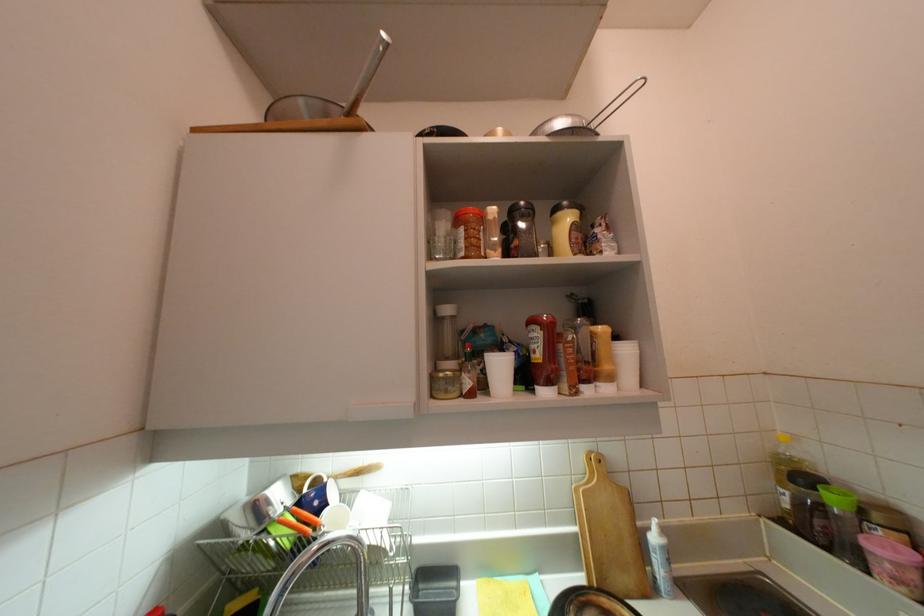
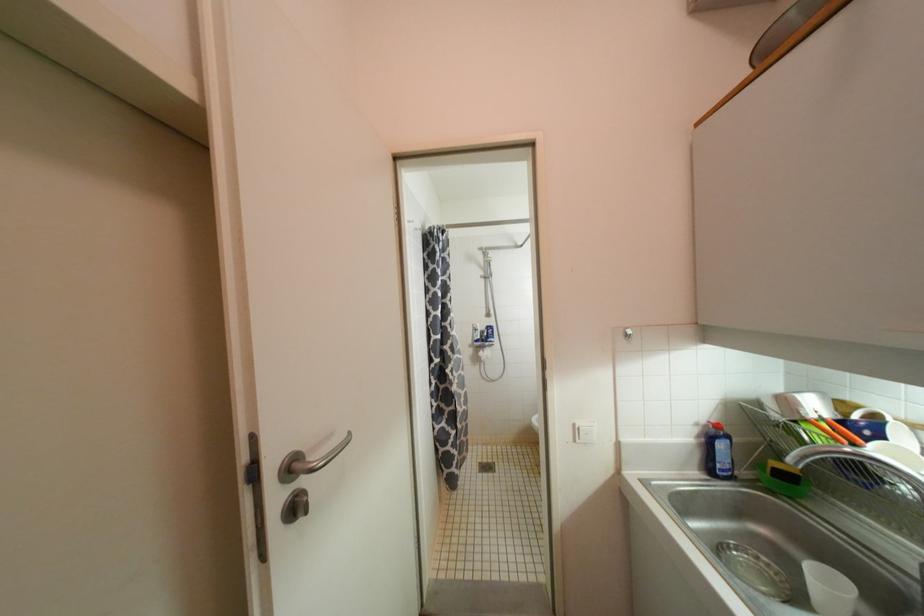
Question: The images are taken continuously from a first-person perspective. In which direction is your viewpoint rotating?

Choices:
 (A) Left
 (B) Right
 (C) Up
 (D) Down

Answer: (A)